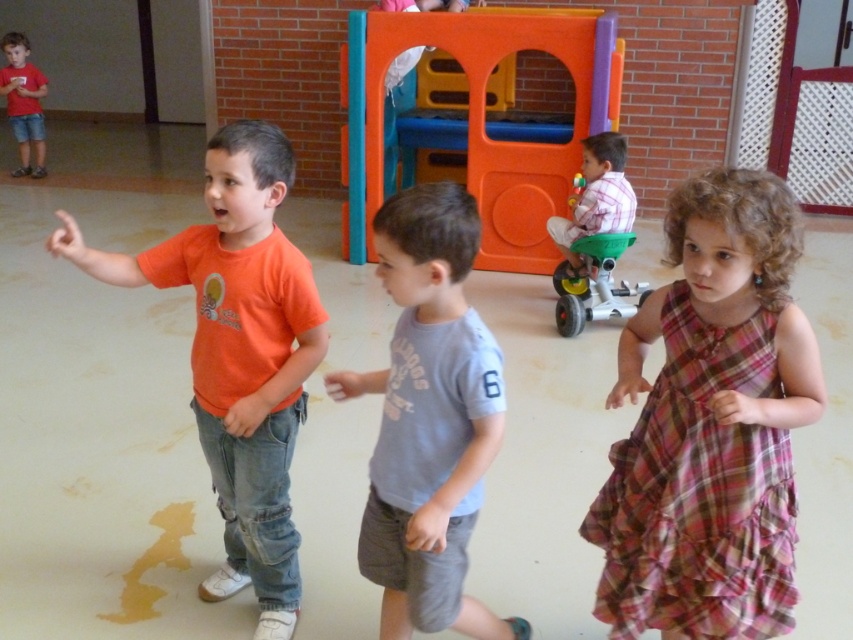
Question: Does plaid fabric dress at center have a larger size compared to plaid fabric shirt at center?

Choices:
 (A) yes
 (B) no

Answer: (A)

Question: Among these points, which one is nearest to the camera?

Choices:
 (A) (577, 189)
 (B) (756, 620)
 (C) (354, 381)

Answer: (B)

Question: Can you confirm if orange plastic playhouse at center is bigger than plaid fabric shirt at center?

Choices:
 (A) no
 (B) yes

Answer: (B)

Question: Which object is closer to the camera taking this photo?

Choices:
 (A) plaid fabric dress at center
 (B) orange plastic playhouse at center
 (C) orange cotton t-shirt at left

Answer: (A)

Question: Which object is farther from the camera taking this photo?

Choices:
 (A) matte red shirt at upper left
 (B) rubberized plastic toy at center
 (C) plaid fabric dress at center

Answer: (A)

Question: Does matte red shirt at upper left have a greater width compared to rubberized plastic toy at center?

Choices:
 (A) yes
 (B) no

Answer: (A)